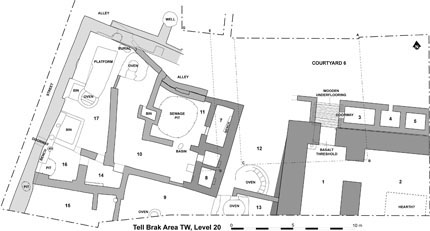
You are a GUI agent. You are given a task and a screenshot of the screen. Output one action in this format:
    pyautogui.click(x=<x>, y=<y>)
    Task: Click on the room 4
    This screenshot has width=430, height=231.
    Given the screenshot: What is the action you would take?
    pyautogui.click(x=386, y=118)